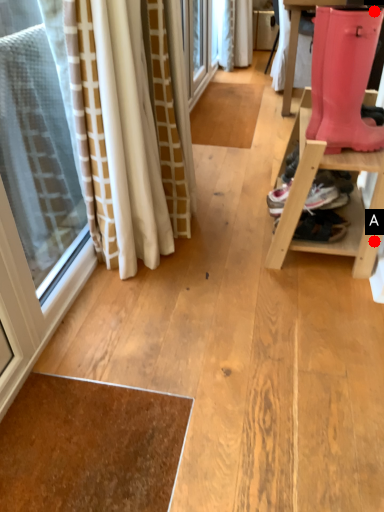
Question: Two points are circled on the image, labeled by A and B beside each circle. Which point is further to the camera?

Choices:
 (A) A is further
 (B) B is further

Answer: (A)